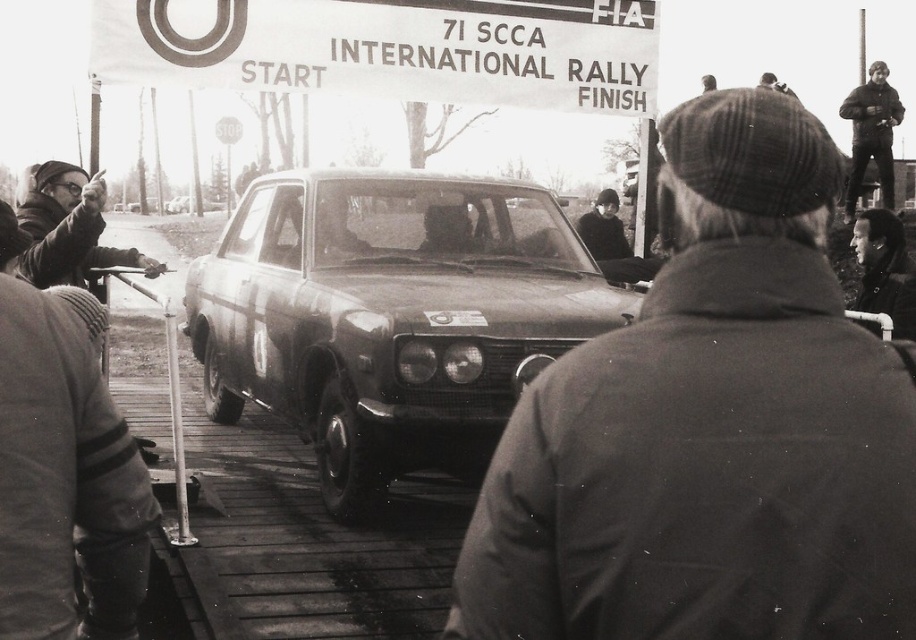
Question: Does coarse woolen cap at center come behind dark brown leather jacket at upper right?

Choices:
 (A) yes
 (B) no

Answer: (B)

Question: Which object appears closest to the camera in this image?

Choices:
 (A) matte black jacket at left
 (B) smooth black jacket at center
 (C) metallic silver sedan at center
 (D) shiny metallic car at center

Answer: (D)

Question: Is dark brown leather jacket at upper right above metallic silver sedan at center?

Choices:
 (A) no
 (B) yes

Answer: (A)

Question: Is shiny metallic car at center smaller than smooth black jacket at center?

Choices:
 (A) yes
 (B) no

Answer: (B)

Question: Which object is farther from the camera taking this photo?

Choices:
 (A) smooth black jacket at center
 (B) matte black jacket at left
 (C) dark brown leather jacket at upper right

Answer: (C)

Question: Based on their relative distances, which object is nearer to the shiny metallic car at center?

Choices:
 (A) metallic silver sedan at center
 (B) matte black jacket at left

Answer: (B)